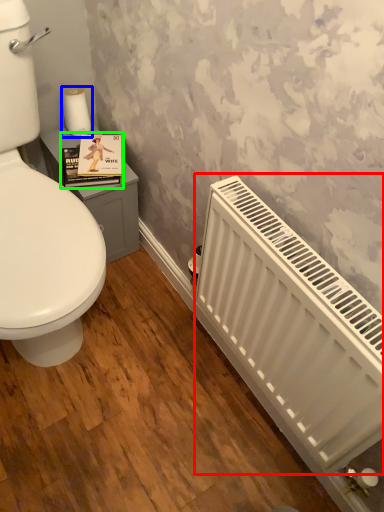
Question: Which is farther away from radiator (highlighted by a red box)? toilet paper (highlighted by a blue box) or book cover (highlighted by a green box)?

Choices:
 (A) toilet paper
 (B) book cover

Answer: (A)